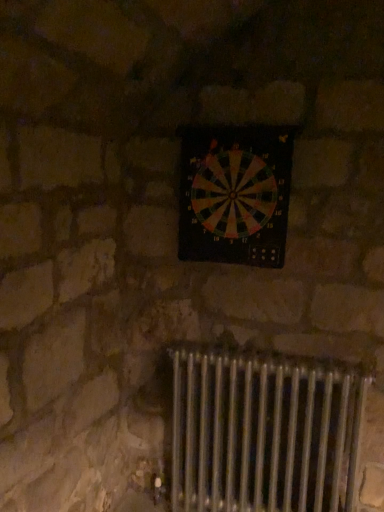
Question: Is metallic radiator at lower center positioned with its back to multicolored plastic dartboard at center?

Choices:
 (A) no
 (B) yes

Answer: (A)

Question: Is multicolored plastic dartboard at center inside metallic radiator at lower center?

Choices:
 (A) no
 (B) yes

Answer: (A)

Question: Can you see metallic radiator at lower center touching multicolored plastic dartboard at center?

Choices:
 (A) yes
 (B) no

Answer: (B)

Question: Does metallic radiator at lower center have a greater height compared to multicolored plastic dartboard at center?

Choices:
 (A) yes
 (B) no

Answer: (A)

Question: Is metallic radiator at lower center at the right side of multicolored plastic dartboard at center?

Choices:
 (A) yes
 (B) no

Answer: (A)

Question: Considering the relative sizes of metallic radiator at lower center and multicolored plastic dartboard at center in the image provided, is metallic radiator at lower center smaller than multicolored plastic dartboard at center?

Choices:
 (A) no
 (B) yes

Answer: (A)

Question: From a real-world perspective, is multicolored plastic dartboard at center physically above metallic radiator at lower center?

Choices:
 (A) yes
 (B) no

Answer: (A)

Question: Considering the relative sizes of multicolored plastic dartboard at center and metallic radiator at lower center in the image provided, is multicolored plastic dartboard at center thinner than metallic radiator at lower center?

Choices:
 (A) no
 (B) yes

Answer: (B)

Question: Does multicolored plastic dartboard at center lie in front of metallic radiator at lower center?

Choices:
 (A) yes
 (B) no

Answer: (B)

Question: Does multicolored plastic dartboard at center have a greater width compared to metallic radiator at lower center?

Choices:
 (A) yes
 (B) no

Answer: (B)

Question: Can you confirm if multicolored plastic dartboard at center is bigger than metallic radiator at lower center?

Choices:
 (A) yes
 (B) no

Answer: (B)

Question: Can metallic radiator at lower center be found inside multicolored plastic dartboard at center?

Choices:
 (A) no
 (B) yes

Answer: (A)

Question: Considering the positions of multicolored plastic dartboard at center and metallic radiator at lower center in the image, is multicolored plastic dartboard at center wider or thinner than metallic radiator at lower center?

Choices:
 (A) wide
 (B) thin

Answer: (B)